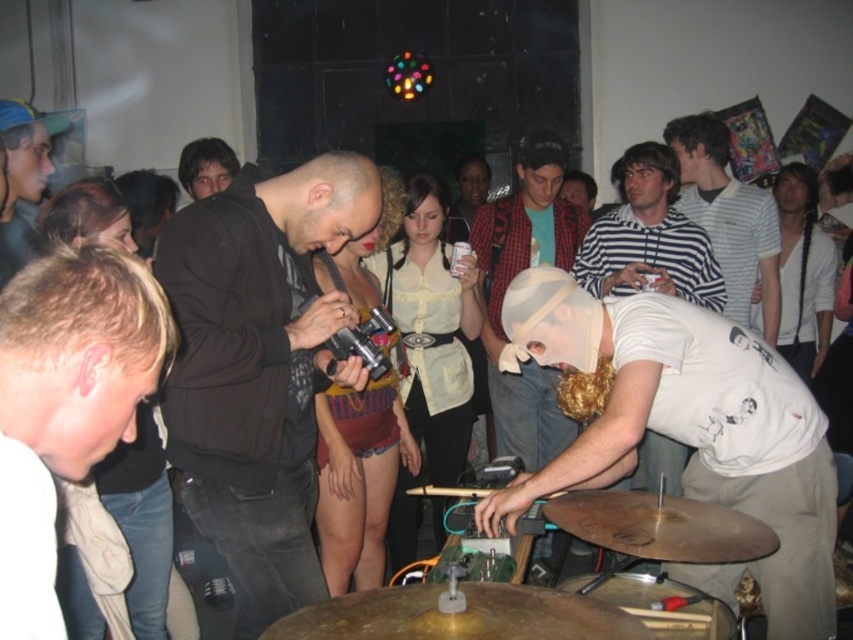
You are a photographer at the party and want to capture a closeup of the black matte jacket at center and the shiny gold cymbal at lower center in the same frame. Given that your camera can only focus on objects within a 1.2 meter width, will both fit without cropping?

The black matte jacket at center is wider than the shiny gold cymbal at lower center. Since the total width of both objects combined may exceed 1.2 meters, it might not fit without cropping. Check their combined width.

You are a photographer trying to capture a candid shot of the drummer wearing the black matte jacket at center. To avoid blocking the shot, you need to position yourself so that the shiny gold cymbal at lower center is not in front of the jacket. Is this possible based on their positions?

The black matte jacket at center is located above the shiny gold cymbal at lower center, so positioning yourself appropriately would allow you to capture the jacket without the cymbal blocking it since the jacket is positioned higher up.